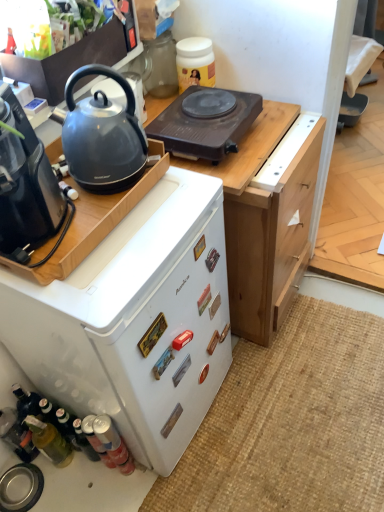
Find the location of a particular element. vacant region in front of translucent glass bottle at lower left is located at coordinates (69, 490).